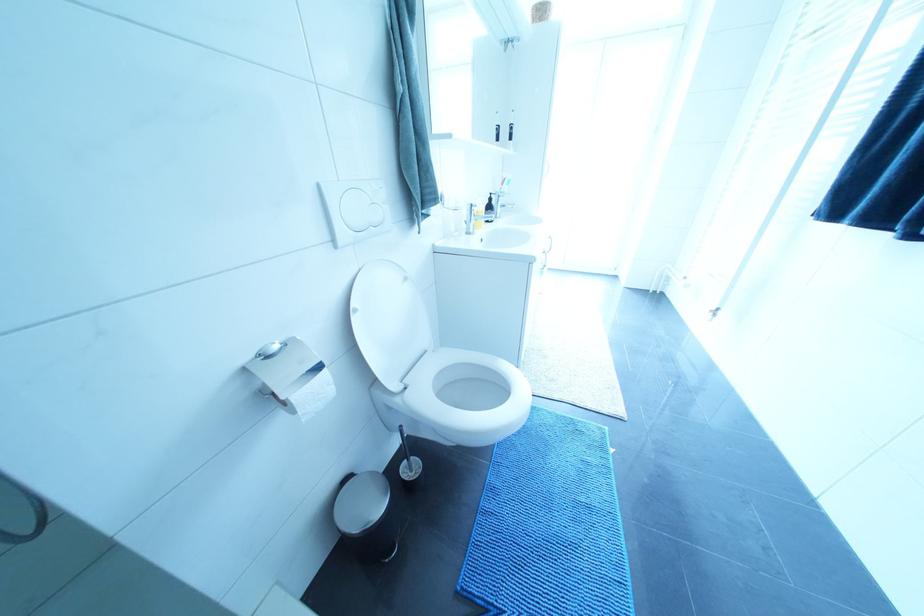
Find where to lift the silver faucet handle. Please return your answer as a coordinate pair (x, y).

(270, 350)